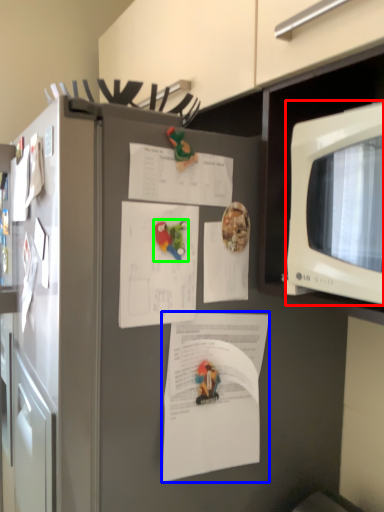
Question: Estimate the real-world distances between objects in this image. Which object is closer to microwave oven (highlighted by a red box), document (highlighted by a blue box) or toy (highlighted by a green box)?

Choices:
 (A) document
 (B) toy

Answer: (B)